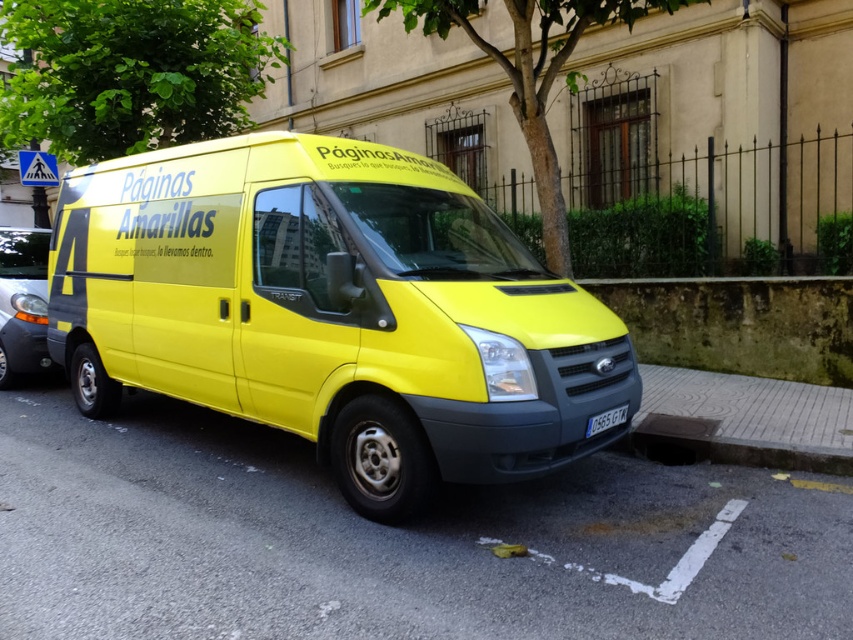
You are a pedestrian standing on the sidewalk and see the yellow matte van at center and the metallic gray car at left. Which vehicle is closer to you?

The yellow matte van at center is closer to you because it is positioned under the metallic gray car at left, indicating it is in front of the car.

You are a driver approaching the intersection and see a metallic gray car at left and a yellow matte license plate at center. Which object is larger in size?

The metallic gray car at left is bigger than the yellow matte license plate at center.